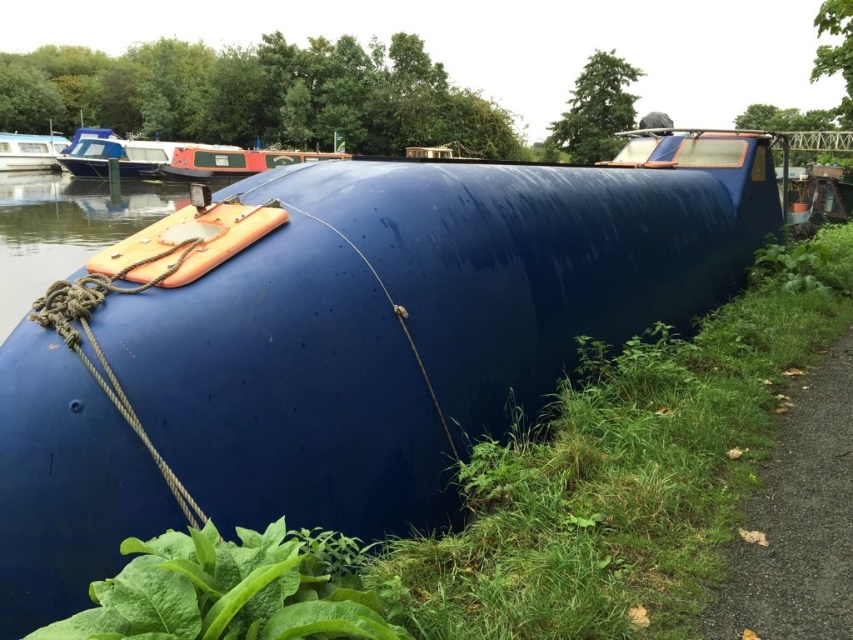
Can you confirm if matte orange buoy at upper left is positioned to the left of matte blue boat at upper left?

No, matte orange buoy at upper left is not to the left of matte blue boat at upper left.

Describe the element at coordinates (119, 154) in the screenshot. I see `matte orange buoy at upper left` at that location.

Locate an element on the screen. matte orange buoy at upper left is located at coordinates (119, 154).

Identify the location of matte orange buoy at upper left. The width and height of the screenshot is (853, 640). (119, 154).

Is green grass at lower right smaller than gravel path at lower right?

No.

In order to click on green grass at lower right in this screenshot , I will do `click(624, 472)`.

Between point (131, 620) and point (206, 172), which one is positioned in front?

Positioned in front is point (131, 620).

Does green leafy plant at lower center have a greater width compared to matte orange buoy at center?

No.

The height and width of the screenshot is (640, 853). What do you see at coordinates (222, 593) in the screenshot? I see `green leafy plant at lower center` at bounding box center [222, 593].

Where is `green leafy plant at lower center`? This screenshot has width=853, height=640. green leafy plant at lower center is located at coordinates (222, 593).